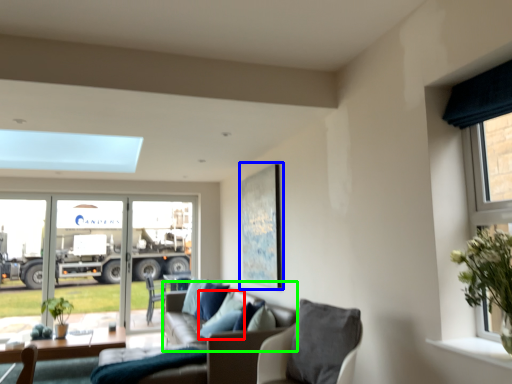
Question: Which is farther away from pillow (highlighted by a red box)? picture frame (highlighted by a blue box) or couch (highlighted by a green box)?

Choices:
 (A) picture frame
 (B) couch

Answer: (A)